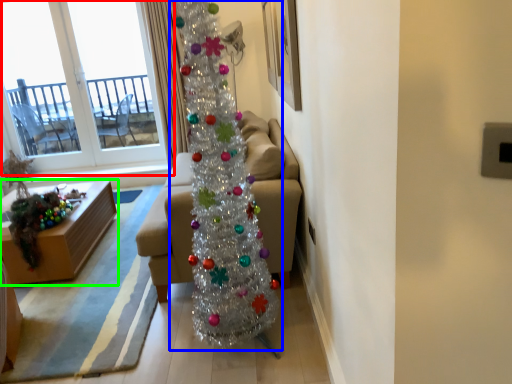
Question: Based on their relative distances, which object is nearer to window (highlighted by a red box)? Choose from christmas tree (highlighted by a blue box) and table (highlighted by a green box).

Choices:
 (A) christmas tree
 (B) table

Answer: (B)